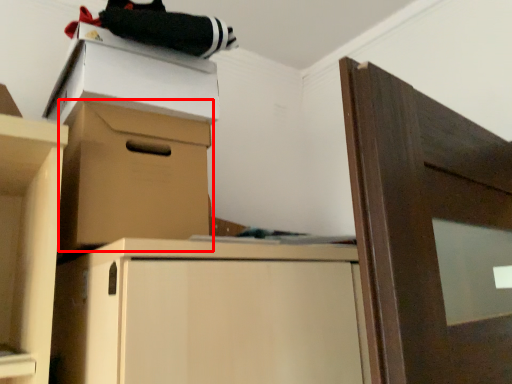
Question: Where is cabinetry (annotated by the red box) located in relation to cardboard box in the image?

Choices:
 (A) right
 (B) left

Answer: (A)